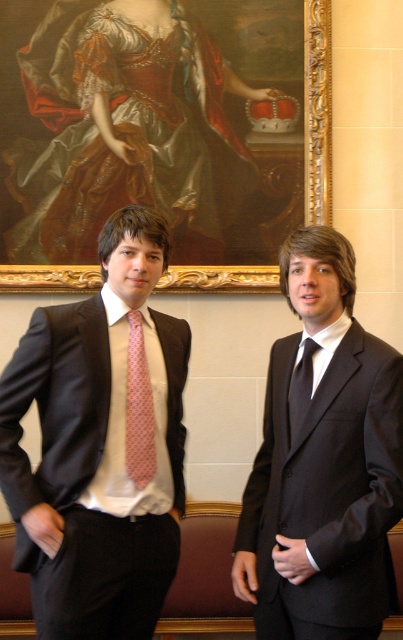
You are a photographer adjusting your camera settings to capture the shiny black suit at center and the matte pink tie at center. Which object should you focus on first if you want to ensure both are in sharp focus, considering their positions relative to the camera?

The shiny black suit at center is located below the matte pink tie at center. To ensure both are in sharp focus, you should focus on the shiny black suit at center first since it is closer to the camera than the matte pink tie at center.

You are organizing a formal event and need to ensure that the matte black suit at center and the matte pink tie at center are displayed properly. Since space is limited, you need to know which of the two takes up more space. Which one is larger?

The matte black suit at center is bigger than the matte pink tie at center, so the matte black suit at center takes up more space and requires more room for display.